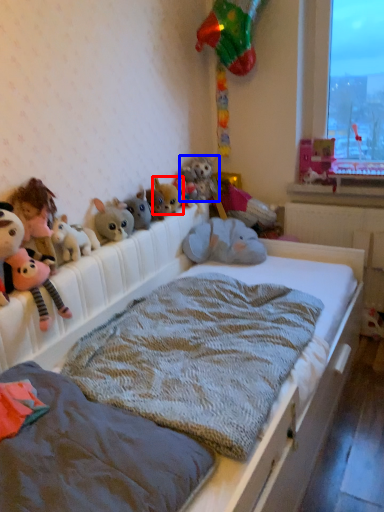
Question: Which of the following is the closest to the observer, toy (highlighted by a red box) or animal (highlighted by a blue box)?

Choices:
 (A) toy
 (B) animal

Answer: (A)